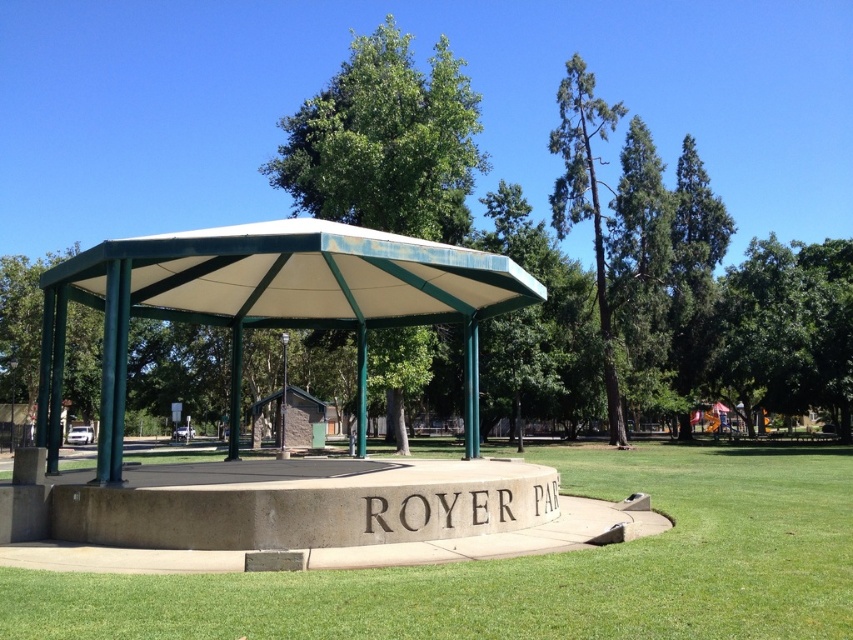
Question: From the image, what is the correct spatial relationship of green grass at center in relation to green leafy tree at center?

Choices:
 (A) above
 (B) below

Answer: (B)

Question: Among these objects, which one is nearest to the camera?

Choices:
 (A) green grass at center
 (B) green textured tree at upper right
 (C) green leafy tree at center

Answer: (A)

Question: Does green grass at center appear over green textured tree at upper right?

Choices:
 (A) no
 (B) yes

Answer: (A)

Question: Which point is closer to the camera?

Choices:
 (A) green textured tree at upper right
 (B) green fabric canopy at center
 (C) green grass at center

Answer: (C)

Question: Based on their relative distances, which object is farther from the green textured tree at upper right?

Choices:
 (A) green fabric canopy at center
 (B) green leafy tree at center
 (C) green grass at center

Answer: (A)

Question: Is green grass at center further to the viewer compared to green textured tree at upper right?

Choices:
 (A) yes
 (B) no

Answer: (B)